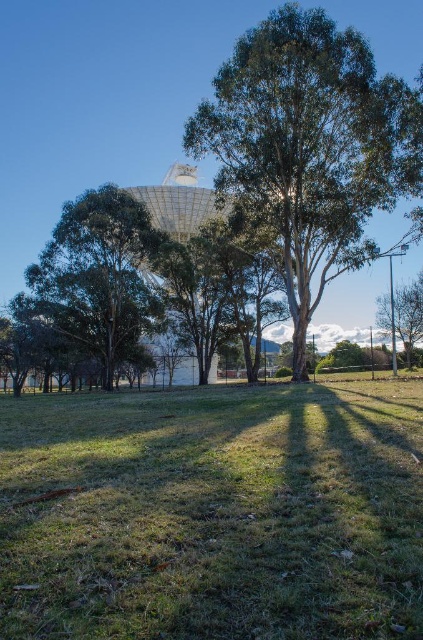
You are standing at the origin point of the image coordinate system. You want to walk to the green grass at center. What are the coordinates you need to move to?

The coordinates you need to move to are approximately 0.803 in the x direction and 0.504 in the y direction.

You are a gardener who needs to mow the lawn. You see the green grass at center and the green leafy tree at right. Which one is shorter?

The green grass at center is shorter than the green leafy tree at right.